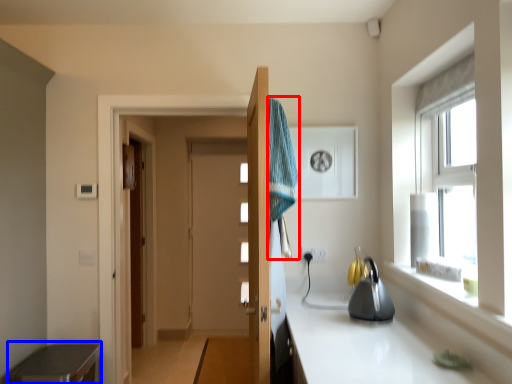
Question: Which point is closer to the camera, bath towel (highlighted by a red box) or cabinetry (highlighted by a blue box)?

Choices:
 (A) bath towel
 (B) cabinetry

Answer: (A)